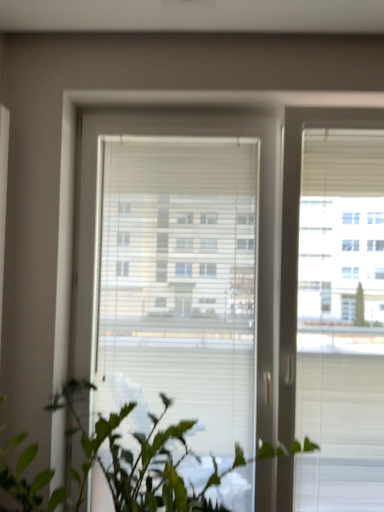
Question: Is white plastic window at center taller than green matte plant at lower left?

Choices:
 (A) no
 (B) yes

Answer: (B)

Question: Is white plastic window at center shorter than green matte plant at lower left?

Choices:
 (A) yes
 (B) no

Answer: (B)

Question: Are white plastic window at center and green matte plant at lower left beside each other?

Choices:
 (A) yes
 (B) no

Answer: (B)

Question: Does white plastic window at center have a larger size compared to green matte plant at lower left?

Choices:
 (A) yes
 (B) no

Answer: (B)

Question: From a real-world perspective, is white plastic window at center physically above green matte plant at lower left?

Choices:
 (A) yes
 (B) no

Answer: (A)

Question: Is white plastic window at center further to the viewer compared to green matte plant at lower left?

Choices:
 (A) no
 (B) yes

Answer: (B)

Question: Is white plastic window at center completely or partially inside green matte plant at lower left?

Choices:
 (A) no
 (B) yes

Answer: (A)

Question: From a real-world perspective, is green matte plant at lower left beneath white plastic window at center?

Choices:
 (A) yes
 (B) no

Answer: (A)

Question: Is green matte plant at lower left to the right of white plastic window at center from the viewer's perspective?

Choices:
 (A) no
 (B) yes

Answer: (A)

Question: Is green matte plant at lower left at the left side of white plastic window at center?

Choices:
 (A) yes
 (B) no

Answer: (A)

Question: Is green matte plant at lower left smaller than white plastic window at center?

Choices:
 (A) yes
 (B) no

Answer: (B)

Question: From the image's perspective, is green matte plant at lower left over white plastic window at center?

Choices:
 (A) no
 (B) yes

Answer: (A)

Question: Considering the positions of green matte plant at lower left and white plastic window at center in the image, is green matte plant at lower left bigger or smaller than white plastic window at center?

Choices:
 (A) big
 (B) small

Answer: (A)